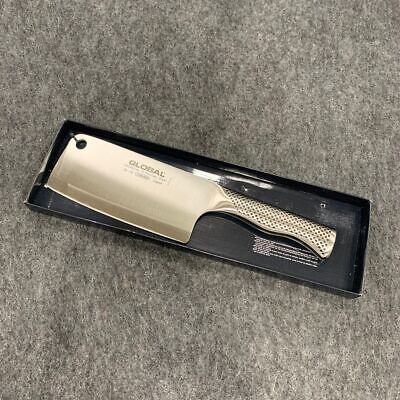
Where is `counter top`? counter top is located at coordinates (59, 306), (160, 335), (312, 97).